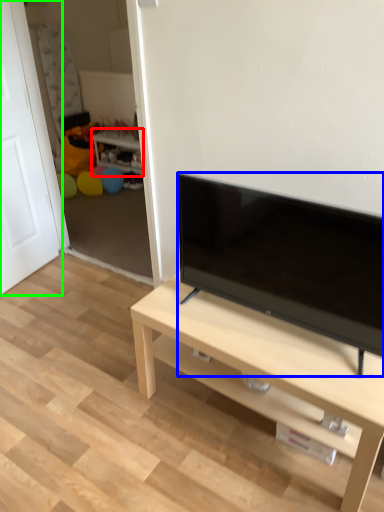
Question: Which is nearer to the side table (highlighted by a red box)? television (highlighted by a blue box) or door (highlighted by a green box).

Choices:
 (A) television
 (B) door

Answer: (B)